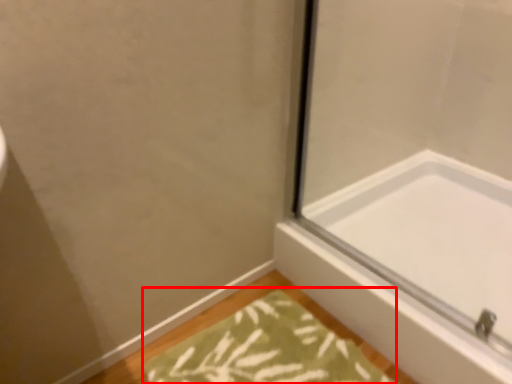
Question: From the image's perspective, considering the relative positions of bath mat (annotated by the red box) and bathtub in the image provided, where is bath mat (annotated by the red box) located with respect to the staircase?

Choices:
 (A) below
 (B) above

Answer: (A)